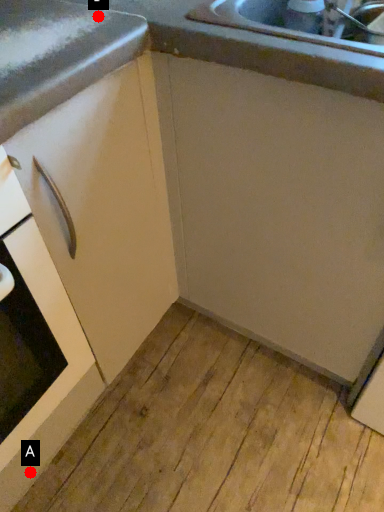
Question: Two points are circled on the image, labeled by A and B beside each circle. Which of the following is the farthest from the observer?

Choices:
 (A) A is further
 (B) B is further

Answer: (A)